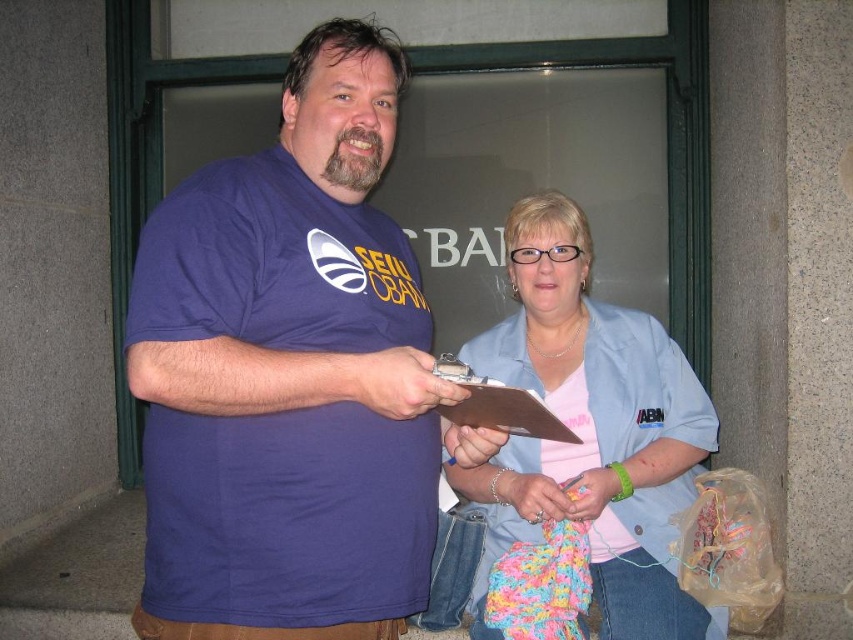
You are a photographer positioned to capture the scene where the woman is crafting. You need to ensure both the light blue fabric at center and the brown cardboard clipboard at center are visible in your shot. Which object should you focus on first to frame the composition properly?

The light blue fabric at center is below the brown cardboard clipboard at center. To frame the composition properly, focus on the brown cardboard clipboard at center first since it is higher up and will help establish the upper part of the frame before including the lower positioned light blue fabric at center.

You are a photographer trying to capture the light blue fabric at center and the brown cardboard clipboard at center. Which object should you focus on first if you want to ensure both are in focus without moving the camera?

The brown cardboard clipboard at center is behind the light blue fabric at center, so you should focus on the light blue fabric at center first. This way, the depth of field will cover both objects since the clipboard is further away.